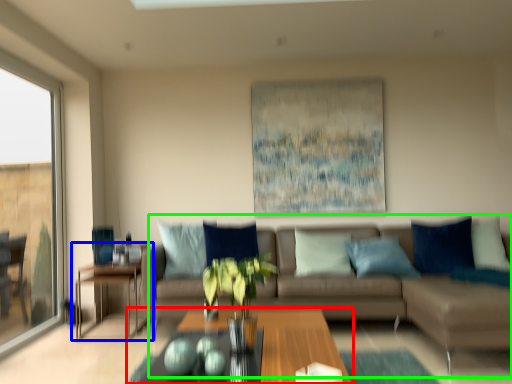
Question: Based on their relative distances, which object is nearer to coffee table (highlighted by a red box)? Choose from table (highlighted by a blue box) and studio couch (highlighted by a green box).

Choices:
 (A) table
 (B) studio couch

Answer: (B)